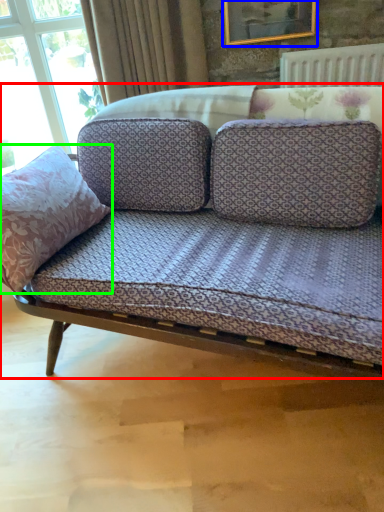
Question: Estimate the real-world distances between objects in this image. Which object is closer to studio couch (highlighted by a red box), picture frame (highlighted by a blue box) or throw pillow (highlighted by a green box)?

Choices:
 (A) picture frame
 (B) throw pillow

Answer: (B)